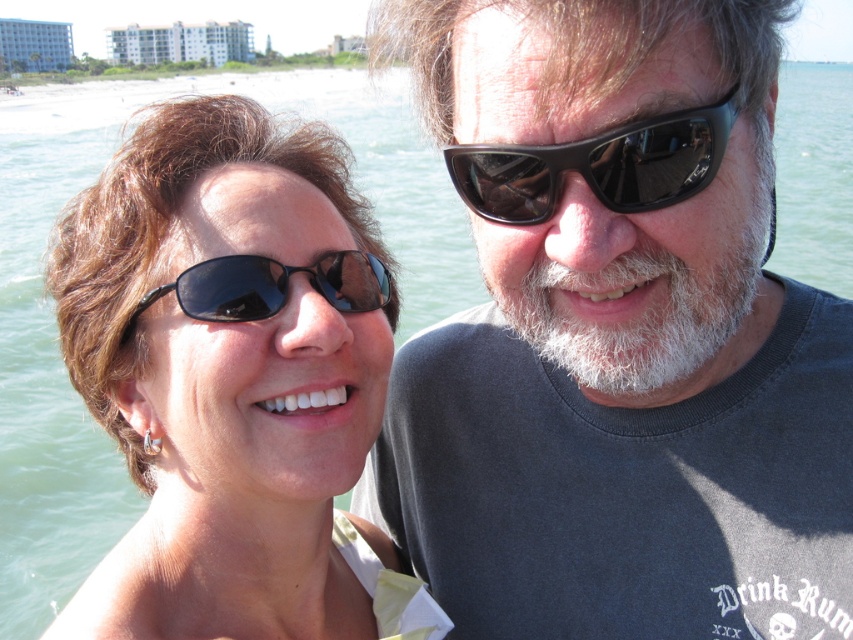
You are a photographer trying to capture both the matte black sunglasses at upper center and the black shiny sunglasses at upper right in a single frame. Based on their sizes, which sunglasses should you focus on to ensure they are both clearly visible in the photo?

The matte black sunglasses at upper center is larger in size compared to the black shiny sunglasses at upper right, so focusing on the matte black sunglasses at upper center will help ensure both are clearly visible in the photo.

What are the coordinates of the matte black sunglasses at upper center in the image?

The coordinates of the matte black sunglasses at upper center are at point (616, 336).